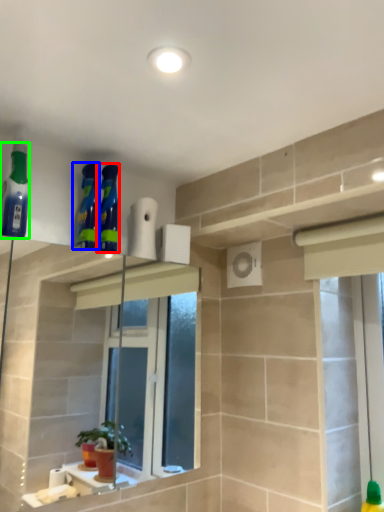
Question: Estimate the real-world distances between objects in this image. Which object is farther from cleaning product (highlighted by a red box), cleaning product (highlighted by a blue box) or cleaning product (highlighted by a green box)?

Choices:
 (A) cleaning product
 (B) cleaning product

Answer: (B)